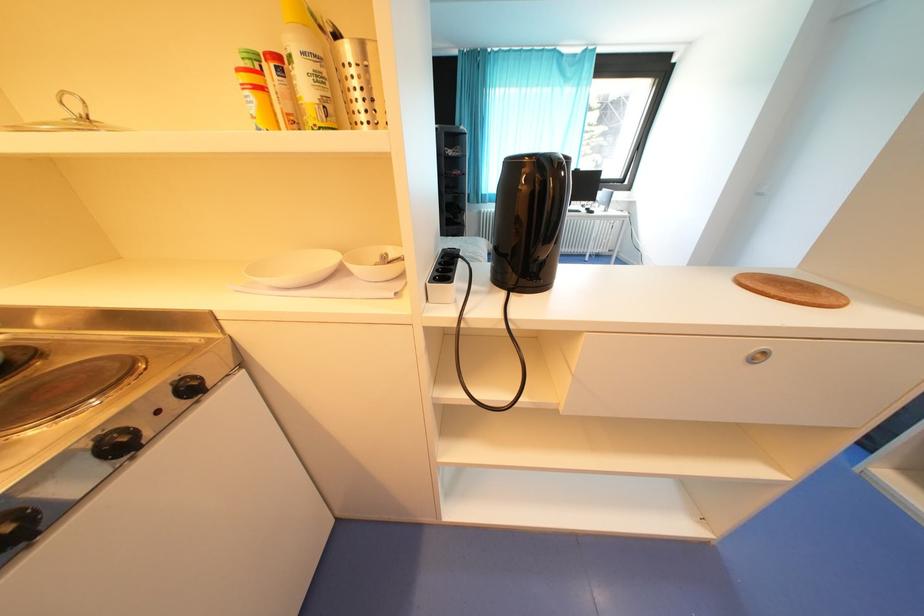
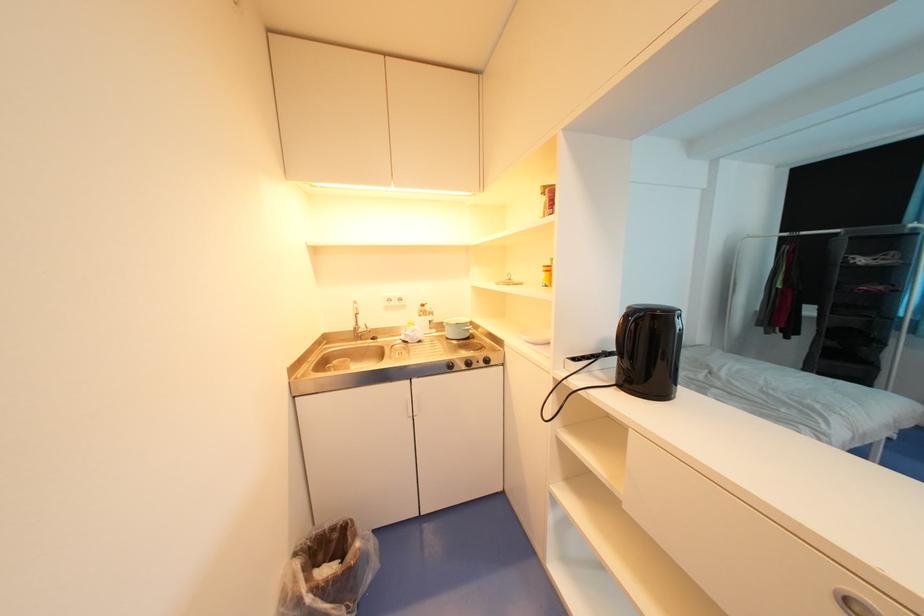
Question: The images are taken continuously from a first-person perspective. In which direction is your viewpoint rotating?

Choices:
 (A) Left
 (B) Right
 (C) Up
 (D) Down

Answer: (A)